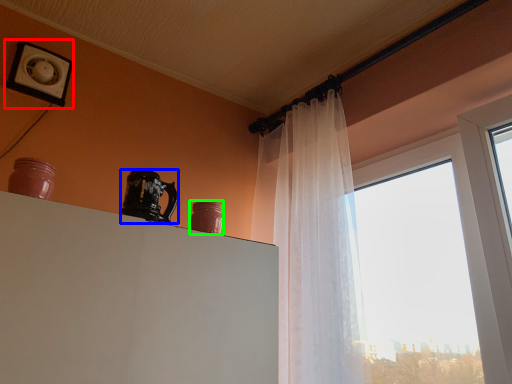
Question: Which is nearer to the picture frame (highlighted by a red box)? coffee cup (highlighted by a blue box) or pottery (highlighted by a green box).

Choices:
 (A) coffee cup
 (B) pottery

Answer: (A)